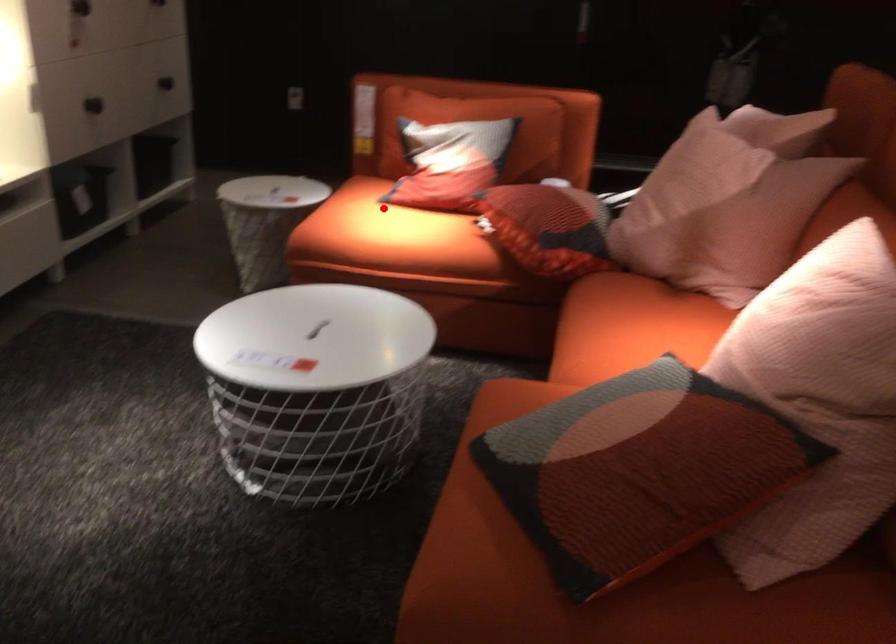
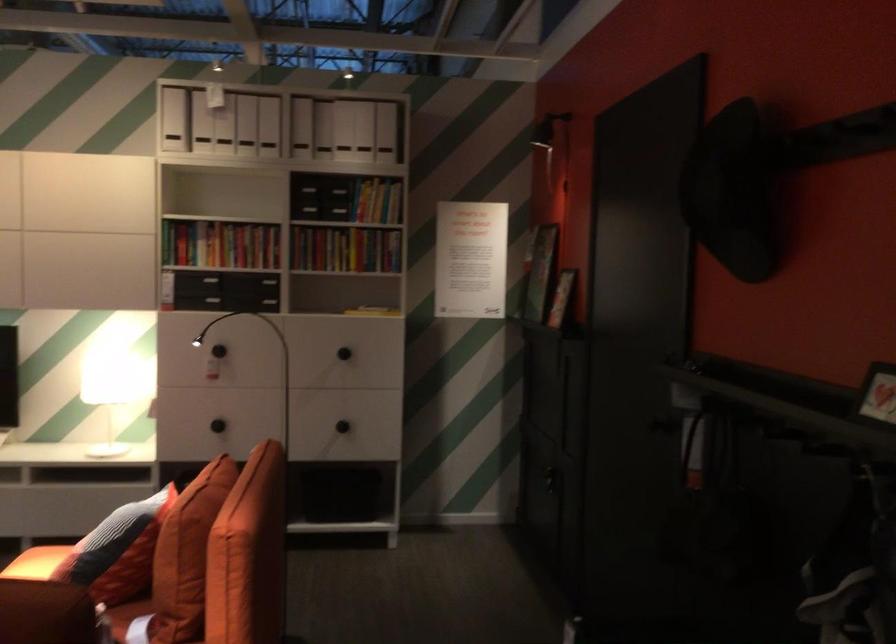
Find the pixel in the second image that matches the highlighted location in the first image.

(36, 563)